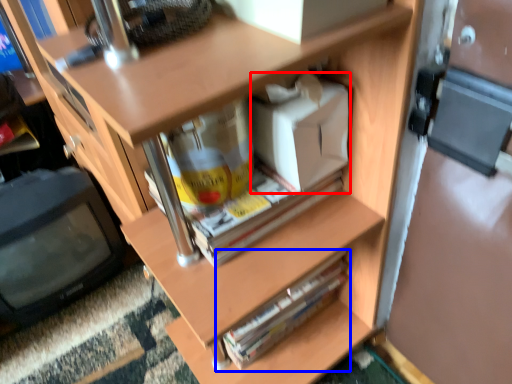
Question: Which object is closer to the camera taking this photo, box (highlighted by a red box) or paperback book (highlighted by a blue box)?

Choices:
 (A) box
 (B) paperback book

Answer: (A)